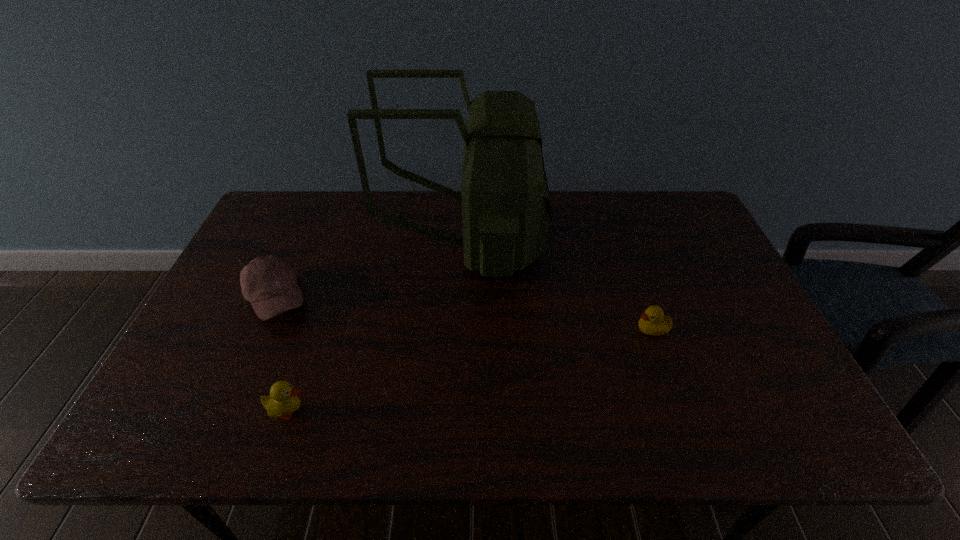
In the image, there is a desktop. Where is `vacant region at the far right corner`? This screenshot has height=540, width=960. vacant region at the far right corner is located at coordinates (655, 219).

This screenshot has width=960, height=540. Find the location of `empty location between the nearer duckling and the third object from left to right`. empty location between the nearer duckling and the third object from left to right is located at coordinates (377, 329).

Where is `empty location between the rightmost object and the baseball cap`? This screenshot has width=960, height=540. empty location between the rightmost object and the baseball cap is located at coordinates (464, 314).

The height and width of the screenshot is (540, 960). In order to click on vacant area that lies between the third object from left to right and the right duckling in this screenshot , I will do `click(559, 288)`.

I want to click on free space that is in between the nearer duckling and the farther duckling, so click(x=470, y=370).

The image size is (960, 540). What are the coordinates of `free space between the left duckling and the third object from left to right` in the screenshot? It's located at (377, 329).

Locate an element on the screen. unoccupied position between the baseball cap and the tallest object is located at coordinates [x=371, y=273].

At what (x,y) coordinates should I click in order to perform the action: click on vacant region between the baseball cap and the second object from right to left. Please return your answer as a coordinate pair (x, y). The width and height of the screenshot is (960, 540). Looking at the image, I should click on (371, 273).

Where is `empty space that is in between the baseball cap and the third object from left to right`? This screenshot has height=540, width=960. empty space that is in between the baseball cap and the third object from left to right is located at coordinates (371, 273).

Locate an element on the screen. The image size is (960, 540). vacant region between the rightmost object and the nearest object is located at coordinates (470, 370).